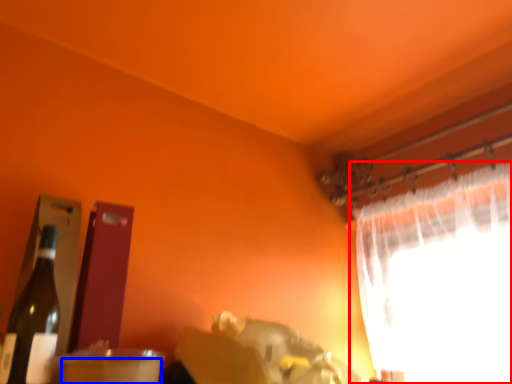
Question: Which of the following is the farthest to the observer, curtain (highlighted by a red box) or drinking straw (highlighted by a blue box)?

Choices:
 (A) curtain
 (B) drinking straw

Answer: (A)